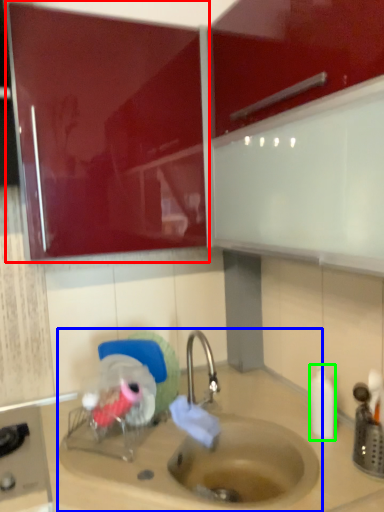
Question: Estimate the real-world distances between objects in this image. Which object is closer to cabinetry (highlighted by a red box), sink (highlighted by a blue box) or bottle (highlighted by a green box)?

Choices:
 (A) sink
 (B) bottle

Answer: (A)